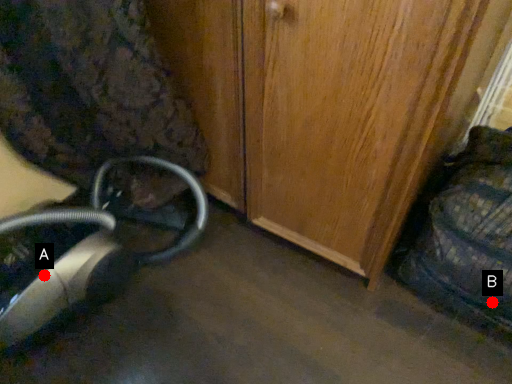
Question: Two points are circled on the image, labeled by A and B beside each circle. Which point appears farthest from the camera in this image?

Choices:
 (A) A is further
 (B) B is further

Answer: (A)